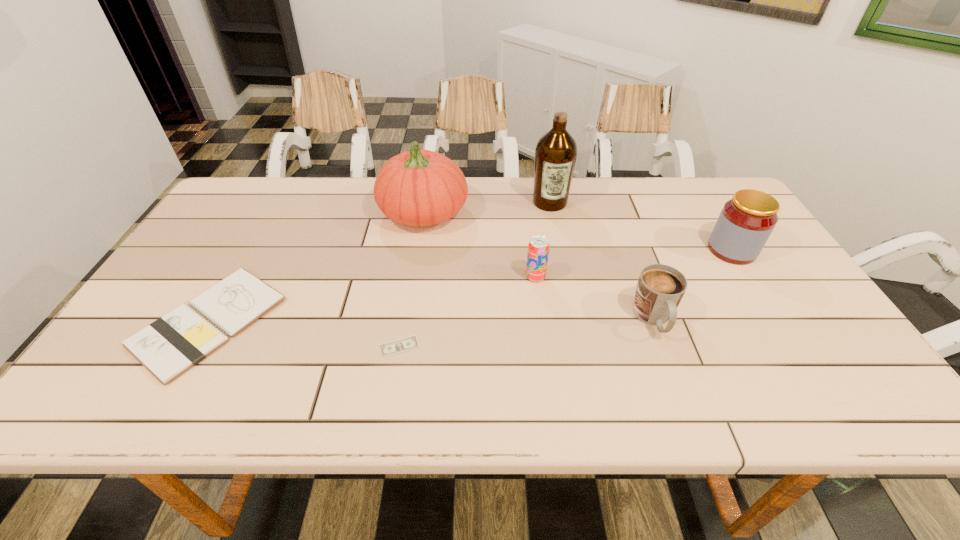
Where is `empty location between the pumpkin and the soda can`? empty location between the pumpkin and the soda can is located at coordinates (480, 245).

Find the location of `empty space that is in between the mug and the olive oil`. empty space that is in between the mug and the olive oil is located at coordinates (602, 261).

At what (x,y) coordinates should I click in order to perform the action: click on free space between the sixth object from left to right and the leftmost object. Please return your answer as a coordinate pair (x, y). The width and height of the screenshot is (960, 540). Looking at the image, I should click on (431, 320).

Locate an element on the screen. Image resolution: width=960 pixels, height=540 pixels. vacant point located between the mug and the money is located at coordinates (527, 333).

Image resolution: width=960 pixels, height=540 pixels. Find the location of `vacant area that lies between the pumpkin and the money`. vacant area that lies between the pumpkin and the money is located at coordinates click(412, 280).

Locate an element on the screen. This screenshot has width=960, height=540. vacant region between the soda can and the sixth shortest object is located at coordinates (480, 245).

Locate an element on the screen. free space between the leftmost object and the soda can is located at coordinates (372, 299).

Where is `object that is the second closest one to the leftmost object`? The image size is (960, 540). object that is the second closest one to the leftmost object is located at coordinates (x=405, y=344).

Find the location of `the sixth closest object to the sixth object from left to right`. the sixth closest object to the sixth object from left to right is located at coordinates 169,346.

The width and height of the screenshot is (960, 540). What are the coordinates of `free region that satisfies the following two spatial constraints: 1. on the back side of the leftmost object; 2. on the left side of the rightmost object` in the screenshot? It's located at (251, 250).